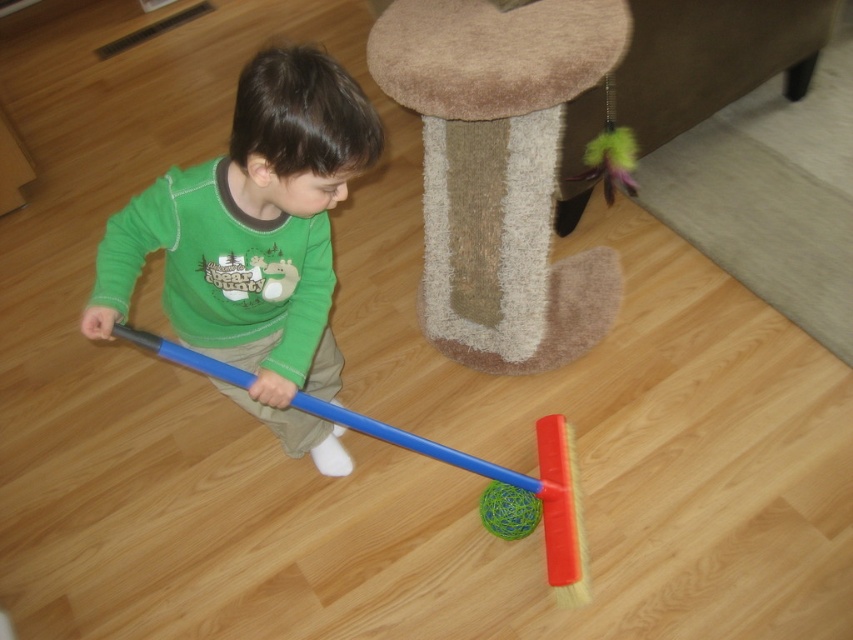
In the scene shown: Can you confirm if beige plush stool at upper center is taller than green matte shirt at center?

Correct, beige plush stool at upper center is much taller as green matte shirt at center.

I want to click on beige plush stool at upper center, so click(x=500, y=170).

At what (x,y) coordinates should I click in order to perform the action: click on beige plush stool at upper center. Please return your answer as a coordinate pair (x, y). This screenshot has height=640, width=853. Looking at the image, I should click on (500, 170).

Between beige plush stool at upper center and blue plastic broom at center, which one appears on the left side from the viewer's perspective?

blue plastic broom at center is more to the left.

The height and width of the screenshot is (640, 853). What are the coordinates of `beige plush stool at upper center` in the screenshot? It's located at (500, 170).

Locate an element on the screen. The image size is (853, 640). beige plush stool at upper center is located at coordinates (500, 170).

Is green matte shirt at center closer to camera compared to blue plastic broom at center?

Yes, it is in front of blue plastic broom at center.

Does point (177, 241) lie behind point (554, 422)?

No, it is in front of (554, 422).

Identify the location of green matte shirt at center. (254, 243).